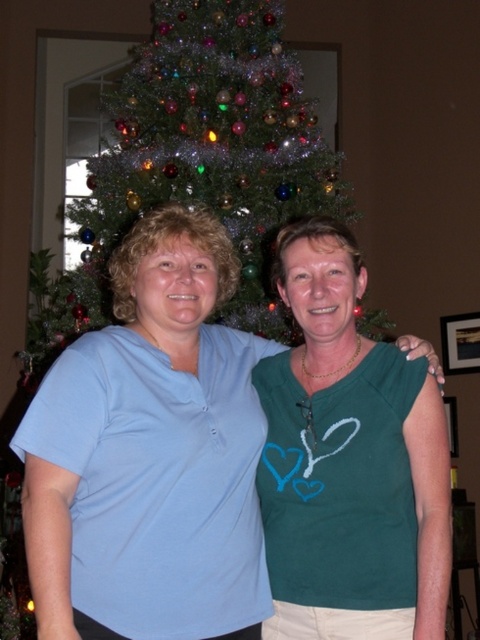
You are a photographer setting up a shot of the light blue cotton shirt at center and the green glittery christmas tree at center. You want to ensure both subjects are in frame. Based on their positions, which object is closer to the right edge of the image?

The light blue cotton shirt at center is positioned on the right side of the green glittery christmas tree at center, so the light blue cotton shirt at center is closer to the right edge of the image.